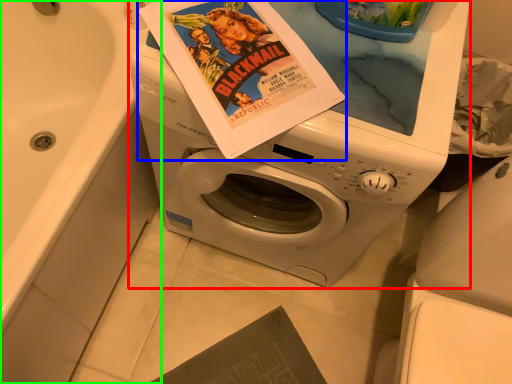
Question: Which is farther away from washing machine (highlighted by a red box)? paperback book (highlighted by a blue box) or bath (highlighted by a green box)?

Choices:
 (A) paperback book
 (B) bath

Answer: (B)